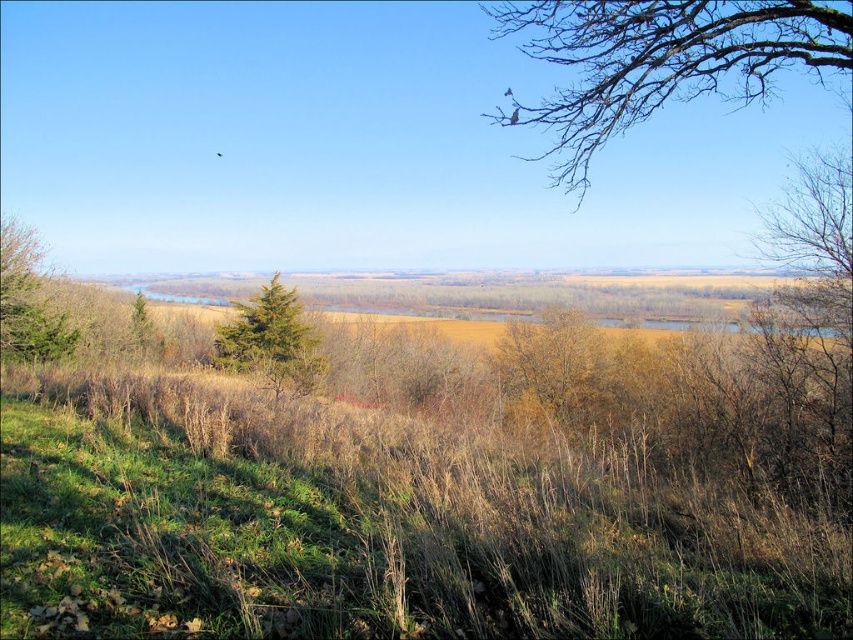
Which is more to the right, green textured tree at center or green matte tree at left?

green textured tree at center is more to the right.

Is point (258, 323) farther from viewer compared to point (18, 320)?

Yes, point (258, 323) is farther from viewer.

This screenshot has height=640, width=853. I want to click on green textured tree at center, so click(271, 339).

Does bare branches at upper right appear over green textured tree at center?

Yes.

Identify the location of bare branches at upper right. The height and width of the screenshot is (640, 853). (660, 60).

Locate an element on the screen. This screenshot has height=640, width=853. bare branches at upper right is located at coordinates (660, 60).

Who is positioned more to the right, bare branches at upper right or green matte tree at left?

From the viewer's perspective, bare branches at upper right appears more on the right side.

Does point (596, 49) come closer to viewer compared to point (38, 305)?

Yes, point (596, 49) is in front of point (38, 305).

Identify the location of bare branches at upper right. (660, 60).